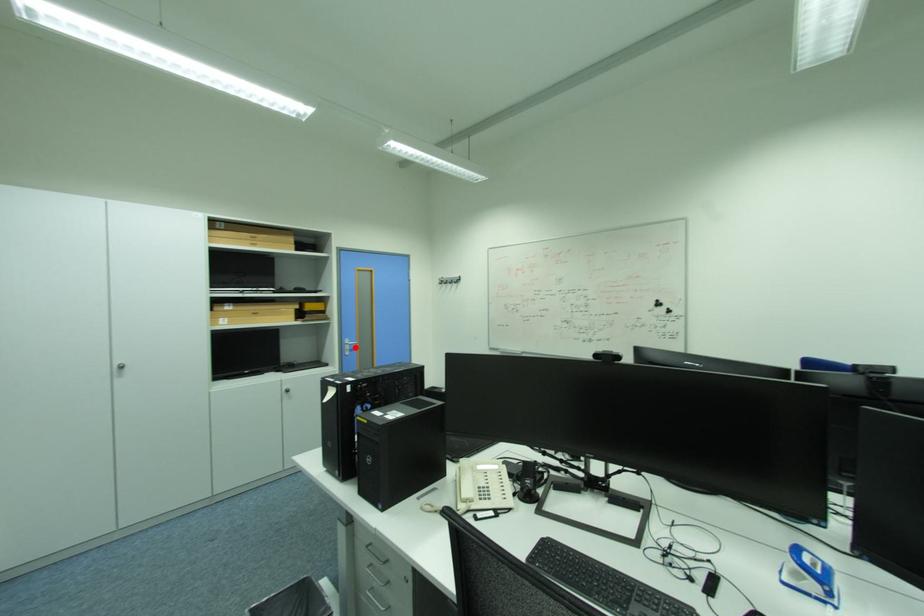
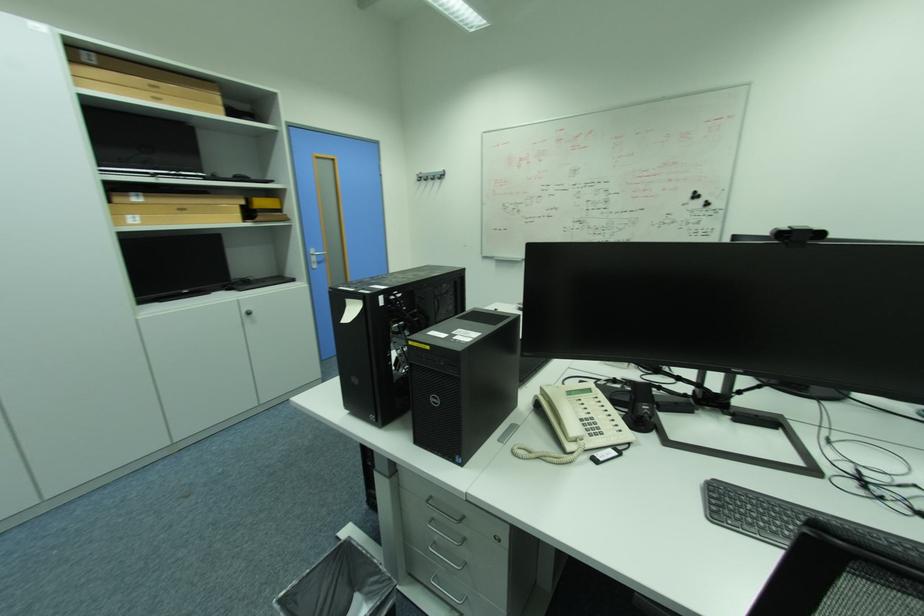
Where in the second image is the point corresponding to the highlighted location from the first image?

(321, 260)